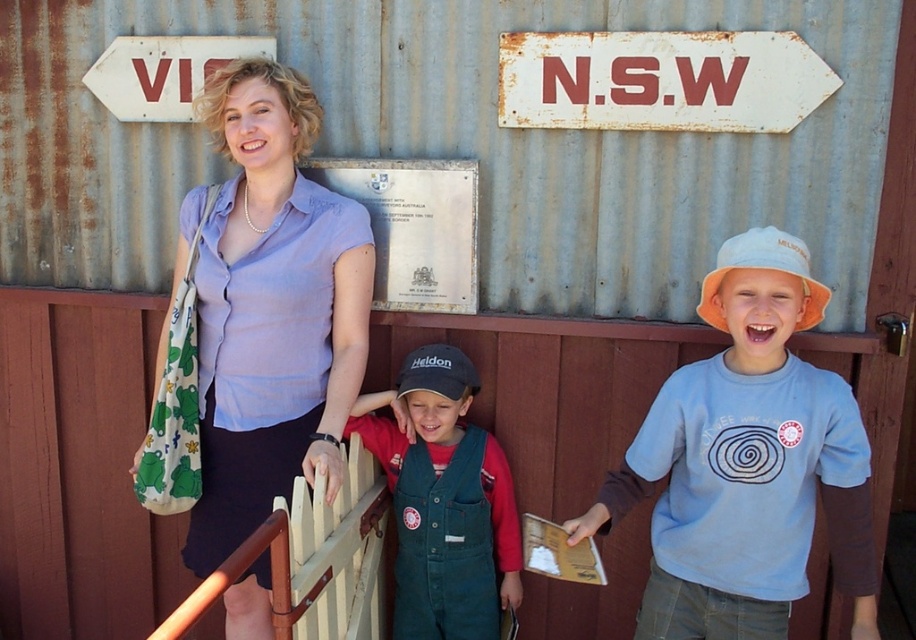
What color is the clothing worn by the person at the point marked as (255, 321)?

The person at the point marked as (255, 321) is wearing a matte purple blouse.

Looking at this image, you are planning to install a new decorative plaque between the rusty metal sign at upper center and the brown wooden rail at center. Considering their sizes, which object should the plaque be placed closer to to maintain visual balance?

The plaque should be placed closer to the rusty metal sign at upper center because it is smaller in size compared to the brown wooden rail at center, so balancing the sizes would require the plaque to offset the larger rail.

You are standing in front of the corrugated metal wall with the two directional signs. You need to reach the rusty metal sign at upper center to adjust its position. However, there is a brown wooden rail at center in your way. Which object do you need to move around first?

The rusty metal sign at upper center is closer to you than the brown wooden rail at center, so you need to move around the brown wooden rail at center first to reach the sign.